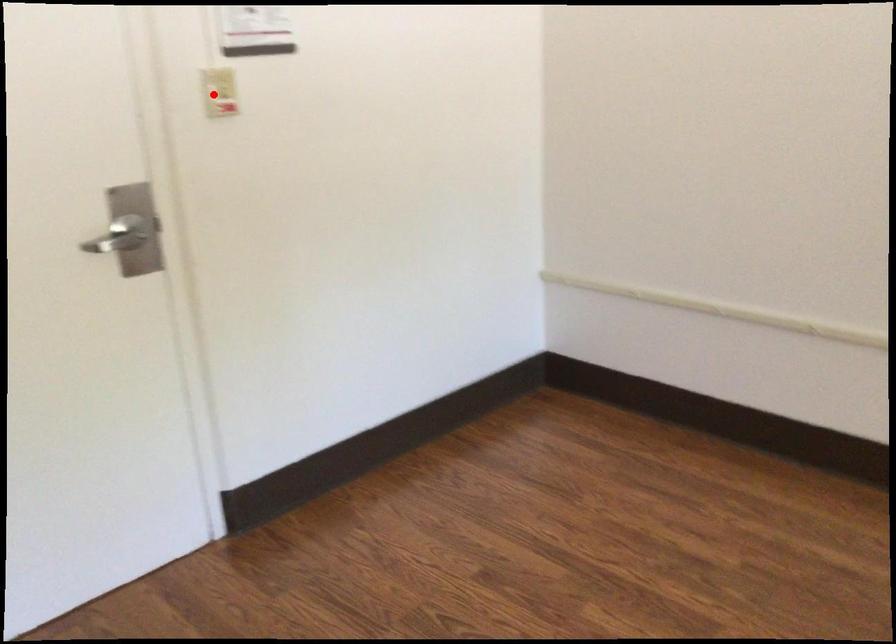
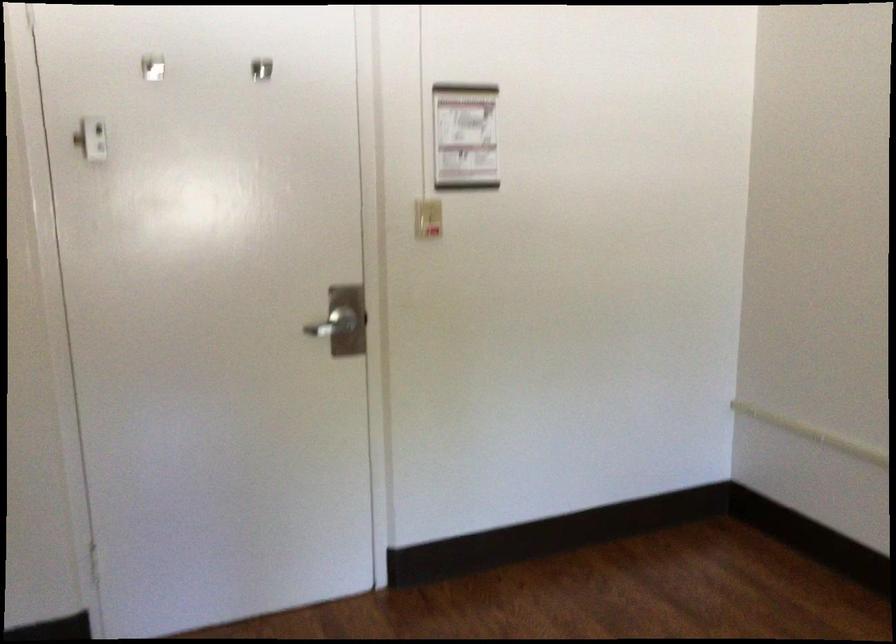
Locate, in the second image, the point that corresponds to the highlighted location in the first image.

(427, 218)